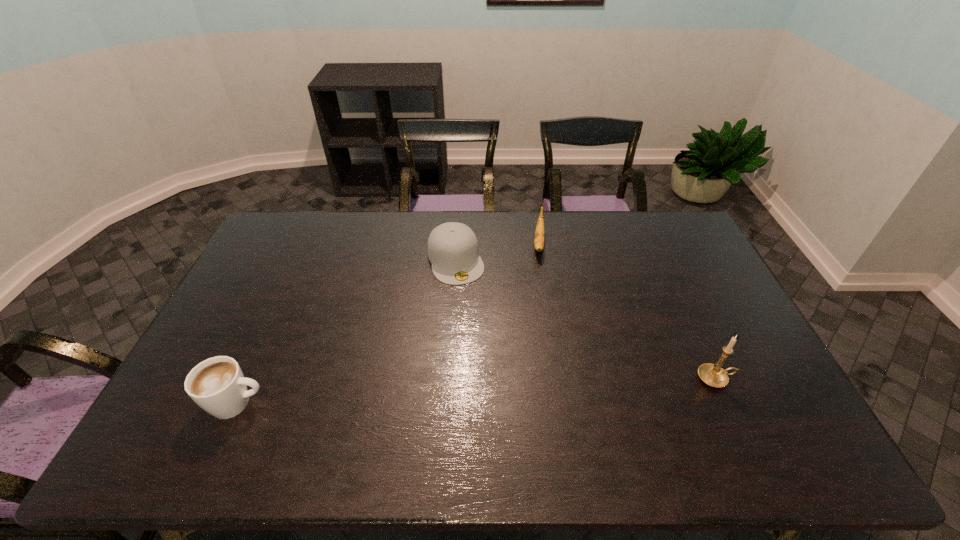
Locate an element on the screen. vacant space at the near edge is located at coordinates (460, 415).

Where is `vacant space at the left edge`? Image resolution: width=960 pixels, height=540 pixels. vacant space at the left edge is located at coordinates (243, 349).

Locate an element on the screen. The image size is (960, 540). free space at the far left corner of the desktop is located at coordinates (281, 245).

Where is `vacant region at the far right corner of the desktop`? vacant region at the far right corner of the desktop is located at coordinates (678, 246).

Find the location of a particular element. The width and height of the screenshot is (960, 540). vacant region at the near right corner of the desktop is located at coordinates (752, 399).

Where is `free space between the rightmost object and the cappuccino`? free space between the rightmost object and the cappuccino is located at coordinates (476, 391).

In order to click on empty space between the second object from right to left and the cappuccino in this screenshot , I will do `click(388, 323)`.

What are the coordinates of `vacant region between the third object from right to left and the banana` in the screenshot? It's located at [x=497, y=252].

Locate an element on the screen. The height and width of the screenshot is (540, 960). free spot between the third object from right to left and the cappuccino is located at coordinates (347, 332).

Locate an element on the screen. unoccupied position between the rightmost object and the leftmost object is located at coordinates (476, 391).